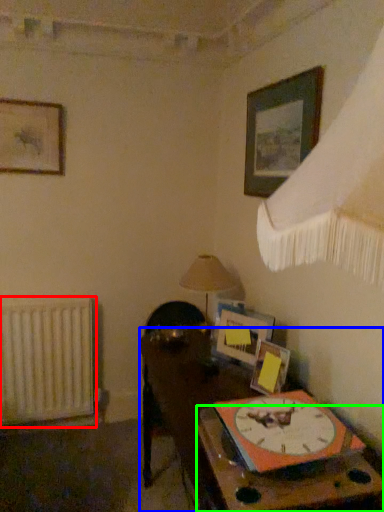
Question: Estimate the real-world distances between objects in this image. Which object is closer to radiator (highlighted by a red box), table (highlighted by a blue box) or table (highlighted by a green box)?

Choices:
 (A) table
 (B) table

Answer: (A)